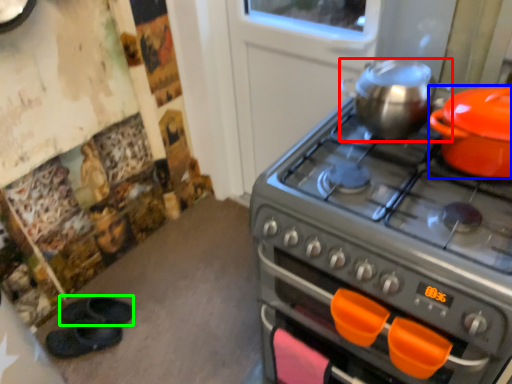
Question: Estimate the real-world distances between objects in this image. Which object is farther from kitchen appliance (highlighted by a red box), kitchen appliance (highlighted by a blue box) or footwear (highlighted by a green box)?

Choices:
 (A) kitchen appliance
 (B) footwear

Answer: (B)